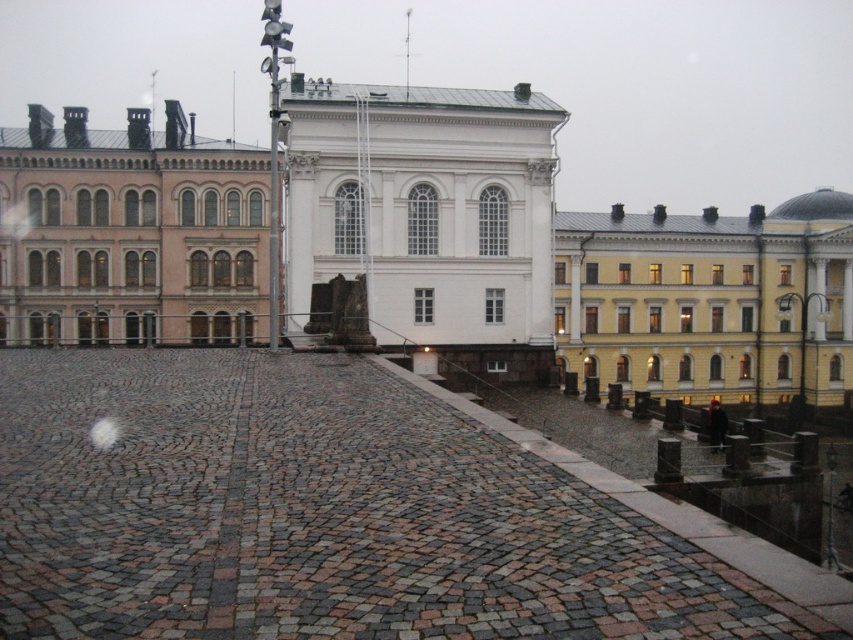
Question: Estimate the real-world distances between objects in this image. Which object is closer to the yellow matte building at upper right?

Choices:
 (A) brown cobblestone courtyard at center
 (B) pink stone building at left

Answer: (B)

Question: Which object appears farthest from the camera in this image?

Choices:
 (A) brown cobblestone courtyard at center
 (B) yellow matte building at upper right
 (C) pink stone building at left

Answer: (B)

Question: Which point is closer to the camera?

Choices:
 (A) brown cobblestone courtyard at center
 (B) yellow matte building at upper right

Answer: (A)

Question: Does white smooth stone building at center have a greater width compared to pink stone building at left?

Choices:
 (A) yes
 (B) no

Answer: (B)

Question: Is white smooth stone building at center below yellow matte building at upper right?

Choices:
 (A) yes
 (B) no

Answer: (B)

Question: Is pink stone building at left smaller than yellow matte building at upper right?

Choices:
 (A) yes
 (B) no

Answer: (A)